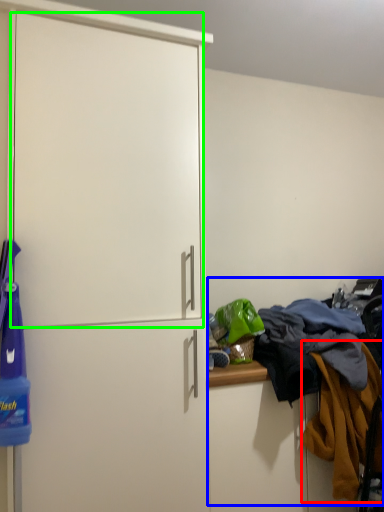
Question: Considering the real-world distances, which object is farthest from clothing (highlighted by a red box)? laundry (highlighted by a blue box) or screen door (highlighted by a green box)?

Choices:
 (A) laundry
 (B) screen door

Answer: (B)